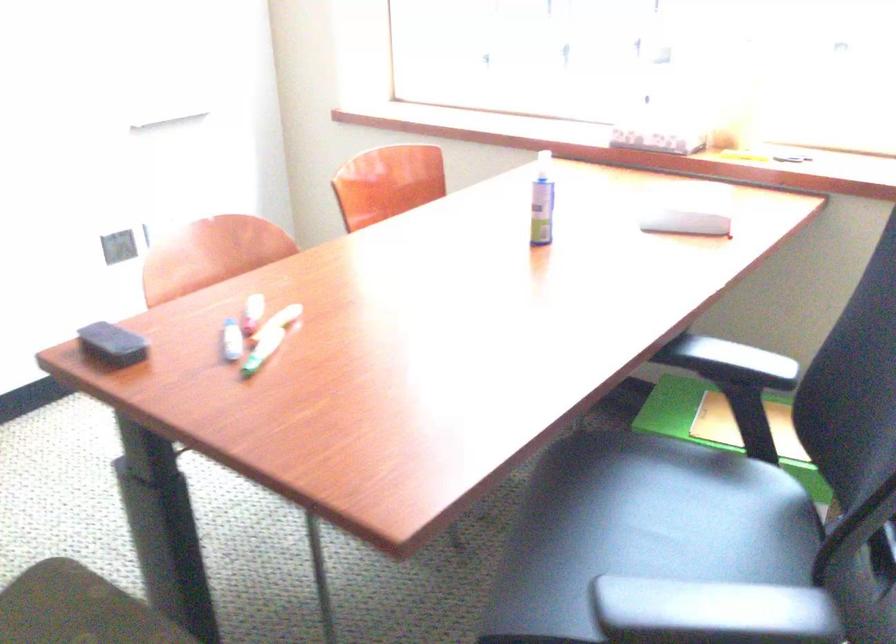
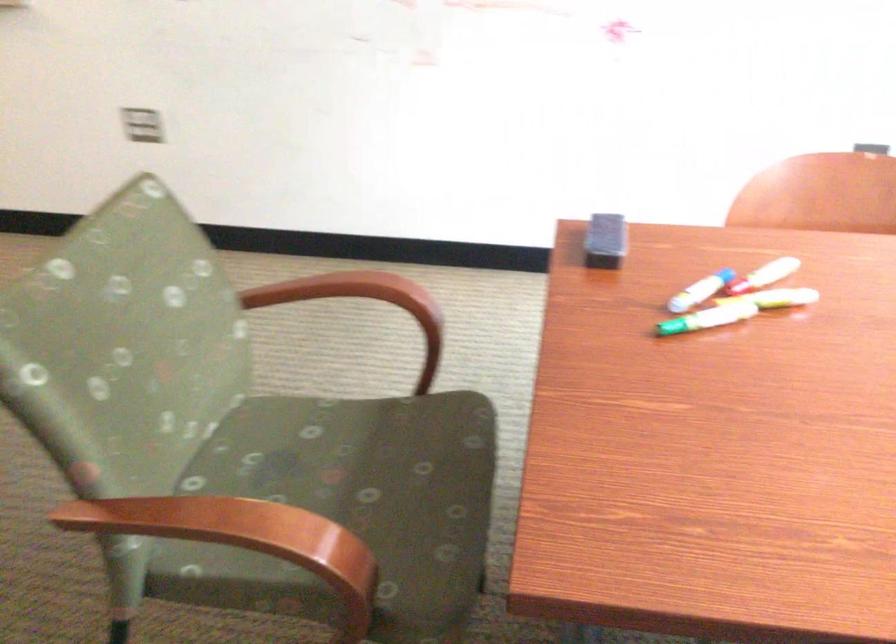
In the second image, find the point that corresponds to (x=264, y=303) in the first image.

(773, 270)